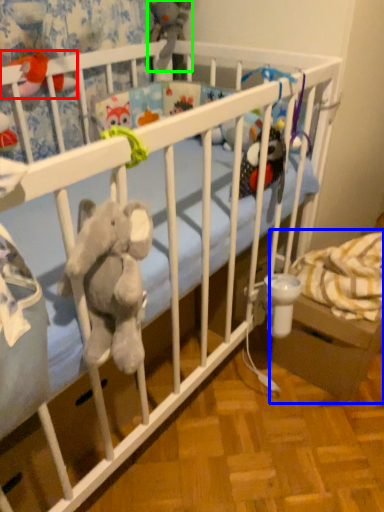
Question: Estimate the real-world distances between objects in this image. Which object is closer to toy (highlighted by a red box), baby carriage (highlighted by a blue box) or toy (highlighted by a green box)?

Choices:
 (A) baby carriage
 (B) toy

Answer: (B)